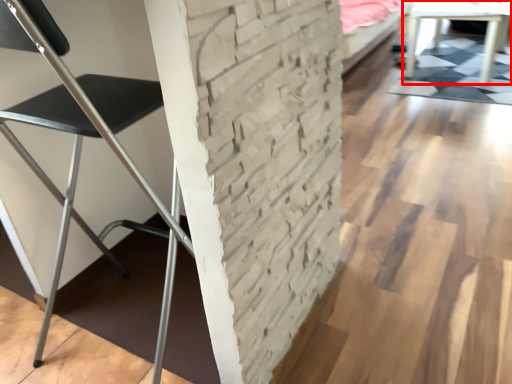
Question: In this image, where is table (annotated by the red box) located relative to chair?

Choices:
 (A) right
 (B) left

Answer: (A)